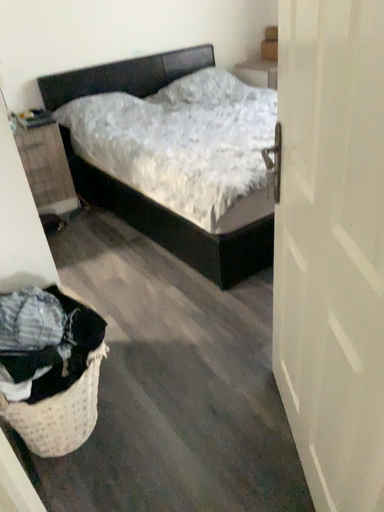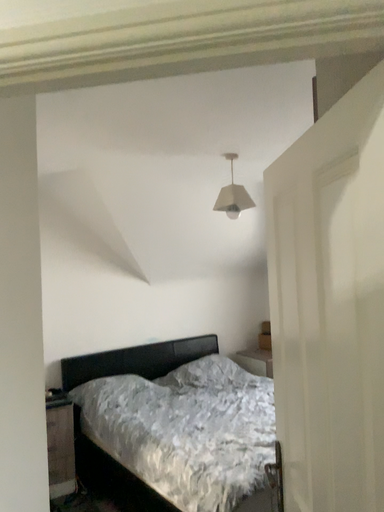
Question: Which way did the camera rotate in the video?

Choices:
 (A) rotated upward
 (B) rotated downward

Answer: (A)